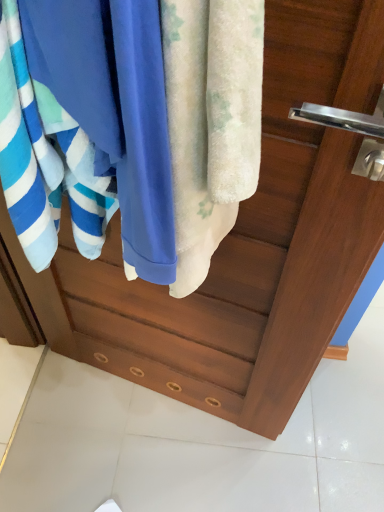
The width and height of the screenshot is (384, 512). Find the location of `blue cotton towel at center`. blue cotton towel at center is located at coordinates (132, 126).

What do you see at coordinates (211, 122) in the screenshot? The height and width of the screenshot is (512, 384). I see `fluffy white towel at center, acting as the 2th towel starting from the left` at bounding box center [211, 122].

You are a GUI agent. You are given a task and a screenshot of the screen. Output one action in this format:
    pyautogui.click(x=<x>, y=<y>)
    Task: Click on the blue soft towel at left, which is the first towel from left to right
    The width and height of the screenshot is (384, 512).
    Given the screenshot: What is the action you would take?
    tap(45, 159)

Considering the sizes of objects fluffy white towel at center, acting as the 2th towel starting from the left, and blue soft towel at left, which is the first towel from left to right, in the image provided, who is bigger, fluffy white towel at center, acting as the 2th towel starting from the left, or blue soft towel at left, which is the first towel from left to right,?

Bigger between the two is blue soft towel at left, which is the first towel from left to right.

Is blue soft towel at left, which is the first towel from left to right, at the back of fluffy white towel at center, the first towel in the right-to-left sequence?

That's not correct — fluffy white towel at center, the first towel in the right-to-left sequence, is not looking away from blue soft towel at left, which is the first towel from left to right.

Based on the photo, between fluffy white towel at center, the first towel in the right-to-left sequence, and blue soft towel at left, marked as the 2th towel in a right-to-left arrangement, which one is positioned in front?

fluffy white towel at center, the first towel in the right-to-left sequence, is in front.

Are fluffy white towel at center, acting as the 2th towel starting from the left, and blue soft towel at left, which is the first towel from left to right, located far from each other?

No.

From the image's perspective, is fluffy white towel at center, acting as the 2th towel starting from the left, below blue cotton towel at center?

Yes, from the image's perspective, fluffy white towel at center, acting as the 2th towel starting from the left, is beneath blue cotton towel at center.

From the picture: Does fluffy white towel at center, the first towel in the right-to-left sequence, have a greater height compared to blue cotton towel at center?

Yes.

From the picture: Are fluffy white towel at center, acting as the 2th towel starting from the left, and blue cotton towel at center beside each other?

Yes.

From a real-world perspective, which object stands above the other?

In real-world perspective, blue cotton towel at center is above.

How different are the orientations of blue soft towel at left, marked as the 2th towel in a right-to-left arrangement, and blue cotton towel at center in degrees?

0.00102 degrees separate the facing orientations of blue soft towel at left, marked as the 2th towel in a right-to-left arrangement, and blue cotton towel at center.

Does blue soft towel at left, which is the first towel from left to right, have a smaller size compared to blue cotton towel at center?

Incorrect, blue soft towel at left, which is the first towel from left to right, is not smaller in size than blue cotton towel at center.

Which of these two, blue soft towel at left, marked as the 2th towel in a right-to-left arrangement, or blue cotton towel at center, is thinner?

blue cotton towel at center is thinner.

Which point is more distant from viewer, (22, 222) or (249, 44)?

Positioned behind is point (22, 222).

Would you say blue cotton towel at center is inside or outside blue soft towel at left, which is the first towel from left to right?

blue cotton towel at center is enclosed within blue soft towel at left, which is the first towel from left to right.

Are blue cotton towel at center and blue soft towel at left, marked as the 2th towel in a right-to-left arrangement, making contact?

Yes, blue cotton towel at center is right next to blue soft towel at left, marked as the 2th towel in a right-to-left arrangement, and making contact.

In the image, is blue cotton towel at center positioned in front of or behind blue soft towel at left, marked as the 2th towel in a right-to-left arrangement?

Visually, blue cotton towel at center is located behind blue soft towel at left, marked as the 2th towel in a right-to-left arrangement.

Which is farther, (172, 249) or (56, 122)?

The point (172, 249) is farther from the camera.

Is blue cotton towel at center bigger or smaller than fluffy white towel at center, acting as the 2th towel starting from the left?

Clearly, blue cotton towel at center is larger in size than fluffy white towel at center, acting as the 2th towel starting from the left.

How distant is blue cotton towel at center from fluffy white towel at center, the first towel in the right-to-left sequence?

They are 2.64 inches apart.

Considering the relative positions of blue cotton towel at center and fluffy white towel at center, the first towel in the right-to-left sequence, in the image provided, is blue cotton towel at center to the left or to the right of fluffy white towel at center, the first towel in the right-to-left sequence,?

Clearly, blue cotton towel at center is on the left of fluffy white towel at center, the first towel in the right-to-left sequence, in the image.

Do you think blue cotton towel at center is within fluffy white towel at center, acting as the 2th towel starting from the left, or outside of it?

blue cotton towel at center is outside fluffy white towel at center, acting as the 2th towel starting from the left.

Between blue soft towel at left, marked as the 2th towel in a right-to-left arrangement, and fluffy white towel at center, acting as the 2th towel starting from the left, which one has smaller width?

With smaller width is fluffy white towel at center, acting as the 2th towel starting from the left.

Between blue soft towel at left, marked as the 2th towel in a right-to-left arrangement, and fluffy white towel at center, acting as the 2th towel starting from the left, which one is positioned behind?

blue soft towel at left, marked as the 2th towel in a right-to-left arrangement, is further from the camera.

Based on the photo, does blue soft towel at left, which is the first towel from left to right, contain fluffy white towel at center, acting as the 2th towel starting from the left?

No, fluffy white towel at center, acting as the 2th towel starting from the left, is not surrounded by blue soft towel at left, which is the first towel from left to right.

Does point (12, 151) come behind point (217, 172)?

Yes.

Identify the location of towel above the fluffy white towel at center, acting as the 2th towel starting from the left (from a real-world perspective). (45, 159).

Identify the location of beach towel that is behind the fluffy white towel at center, the first towel in the right-to-left sequence. This screenshot has width=384, height=512. (132, 126).

Based on their spatial positions, is fluffy white towel at center, the first towel in the right-to-left sequence, or blue soft towel at left, marked as the 2th towel in a right-to-left arrangement, closer to blue cotton towel at center?

fluffy white towel at center, the first towel in the right-to-left sequence.

Estimate the real-world distances between objects in this image. Which object is further from blue soft towel at left, marked as the 2th towel in a right-to-left arrangement, blue cotton towel at center or fluffy white towel at center, the first towel in the right-to-left sequence?

fluffy white towel at center, the first towel in the right-to-left sequence.

Based on their spatial positions, is blue soft towel at left, which is the first towel from left to right, or blue cotton towel at center further from fluffy white towel at center, acting as the 2th towel starting from the left?

Among the two, blue soft towel at left, which is the first towel from left to right, is located further to fluffy white towel at center, acting as the 2th towel starting from the left.

When comparing their distances from fluffy white towel at center, the first towel in the right-to-left sequence, does blue cotton towel at center or blue soft towel at left, which is the first towel from left to right, seem further?

blue soft towel at left, which is the first towel from left to right.

Considering their positions, is fluffy white towel at center, acting as the 2th towel starting from the left, positioned further to blue soft towel at left, which is the first towel from left to right, than blue cotton towel at center?

fluffy white towel at center, acting as the 2th towel starting from the left, is positioned further to the anchor blue soft towel at left, which is the first towel from left to right.

From the image, which object appears to be nearer to blue cotton towel at center, blue soft towel at left, which is the first towel from left to right, or fluffy white towel at center, the first towel in the right-to-left sequence?

fluffy white towel at center, the first towel in the right-to-left sequence, is positioned closer to the anchor blue cotton towel at center.

This screenshot has height=512, width=384. Find the location of `beach towel located between blue soft towel at left, marked as the 2th towel in a right-to-left arrangement, and fluffy white towel at center, the first towel in the right-to-left sequence, in the left-right direction`. beach towel located between blue soft towel at left, marked as the 2th towel in a right-to-left arrangement, and fluffy white towel at center, the first towel in the right-to-left sequence, in the left-right direction is located at coordinates (132, 126).